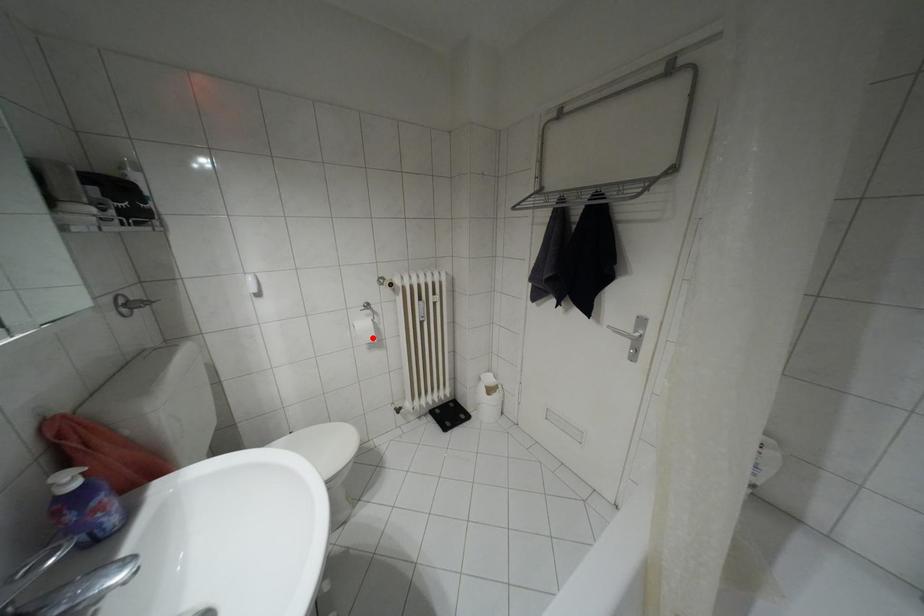
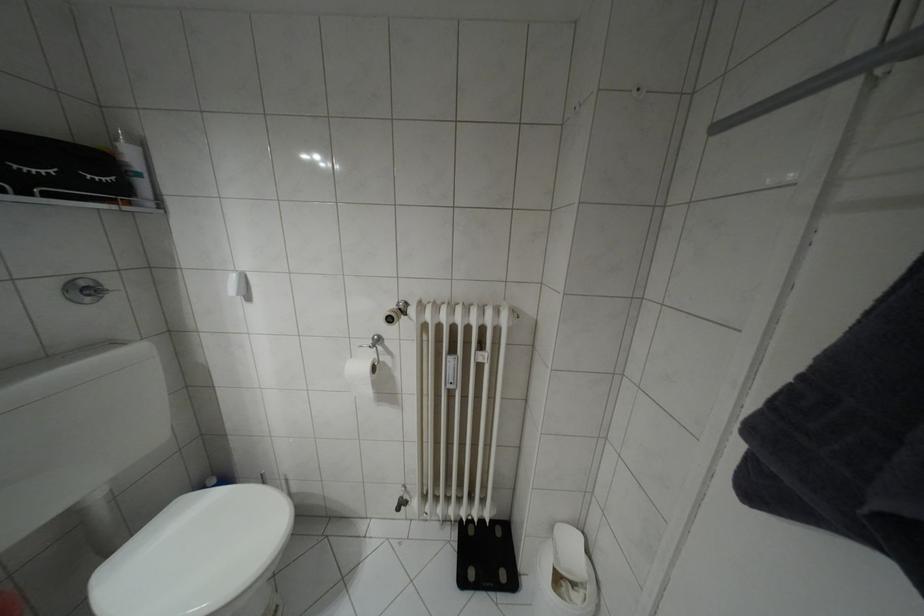
The point at the highlighted location is marked in the first image. Where is the corresponding point in the second image?

(369, 392)